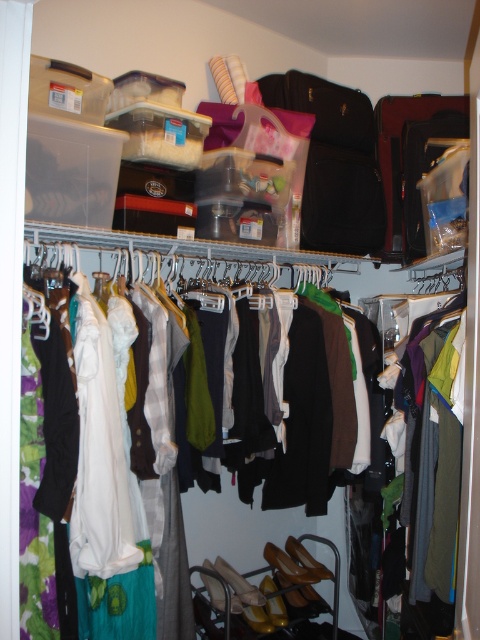
Between black leather suitcase at upper right and white plastic hanger at center, which one is positioned higher?

black leather suitcase at upper right is above.

Does point (369, 214) come behind point (213, 273)?

Yes, it is behind point (213, 273).

Image resolution: width=480 pixels, height=640 pixels. What are the coordinates of `black leather suitcase at upper right` in the screenshot? It's located at (335, 163).

Is white plastic hanger at center above matte black suitcase at center?

Actually, white plastic hanger at center is below matte black suitcase at center.

Is point (173, 257) more distant than point (385, 164)?

No, it is in front of (385, 164).

I want to click on white plastic hanger at center, so click(194, 257).

Is black leather suitcase at upper right further to the viewer compared to matte black suitcase at center?

No, it is not.

Is black leather suitcase at upper right wider than matte black suitcase at center?

Yes.

Is point (376, 234) positioned behind point (382, 122)?

No, it is not.

At what (x,y) coordinates should I click in order to perform the action: click on black leather suitcase at upper right. Please return your answer as a coordinate pair (x, y). This screenshot has width=480, height=640. Looking at the image, I should click on (335, 163).